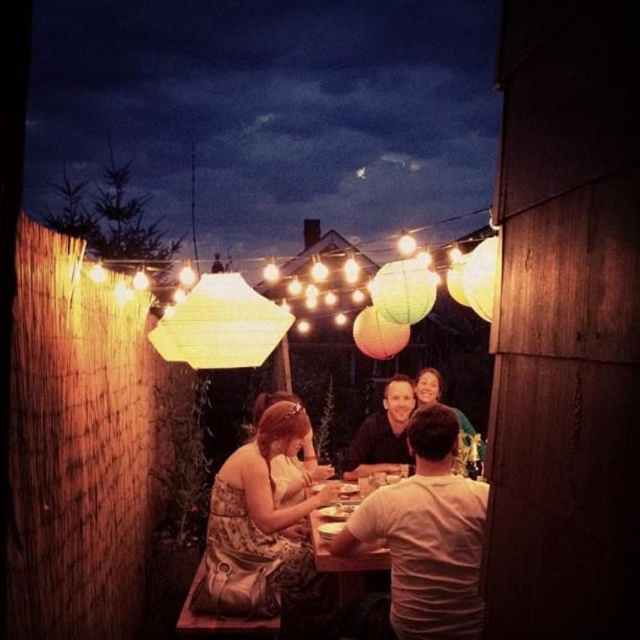
Who is taller, matte black shirt at center or wooden table at center?

matte black shirt at center is taller.

From the picture: Which is above, matte black shirt at center or wooden table at center?

matte black shirt at center is above.

Does point (403, 376) come behind point (344, 557)?

Yes, point (403, 376) is farther from viewer.

This screenshot has height=640, width=640. What are the coordinates of `matte black shirt at center` in the screenshot? It's located at (384, 435).

Is matte black shirt at center smaller than smooth brown hair at center?

Yes, matte black shirt at center is smaller than smooth brown hair at center.

Consider the image. Is matte black shirt at center thinner than smooth brown hair at center?

Incorrect, matte black shirt at center's width is not less than smooth brown hair at center's.

This screenshot has width=640, height=640. Describe the element at coordinates (384, 435) in the screenshot. I see `matte black shirt at center` at that location.

Where is `matte black shirt at center`? matte black shirt at center is located at coordinates (384, 435).

Who is higher up, white cotton t-shirt at center or smooth brown hair at center?

smooth brown hair at center

Measure the distance between white cotton t-shirt at center and smooth brown hair at center.

The distance of white cotton t-shirt at center from smooth brown hair at center is 4.15 feet.

Which is behind, point (440, 563) or point (461, 426)?

The point (461, 426) is more distant.

Find the location of a particular element. white cotton t-shirt at center is located at coordinates (428, 534).